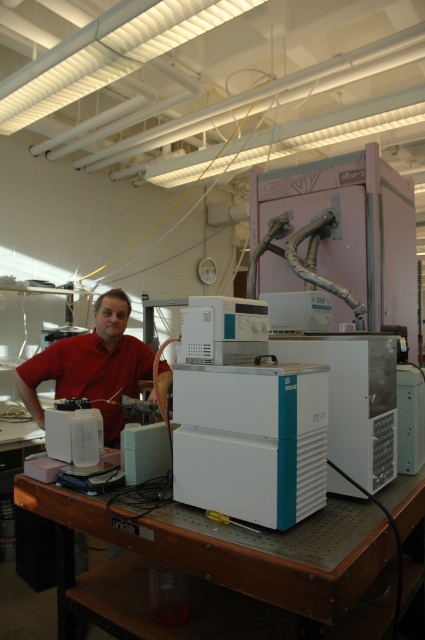
Question: Which object appears closest to the camera in this image?

Choices:
 (A) matte red shirt at center
 (B) white plastic equipment at center

Answer: (B)

Question: Can you confirm if white plastic equipment at center is positioned below white plastic workbench at lower center?

Choices:
 (A) yes
 (B) no

Answer: (B)

Question: Among these points, which one is nearest to the camera?

Choices:
 (A) (127, 387)
 (B) (283, 452)

Answer: (B)

Question: Is white plastic equipment at center above matte red shirt at center?

Choices:
 (A) yes
 (B) no

Answer: (A)

Question: Which point is farther to the camera?

Choices:
 (A) matte red shirt at center
 (B) white plastic equipment at center
 (C) white plastic workbench at lower center

Answer: (A)

Question: Is matte red shirt at center to the left of white plastic workbench at lower center from the viewer's perspective?

Choices:
 (A) no
 (B) yes

Answer: (B)